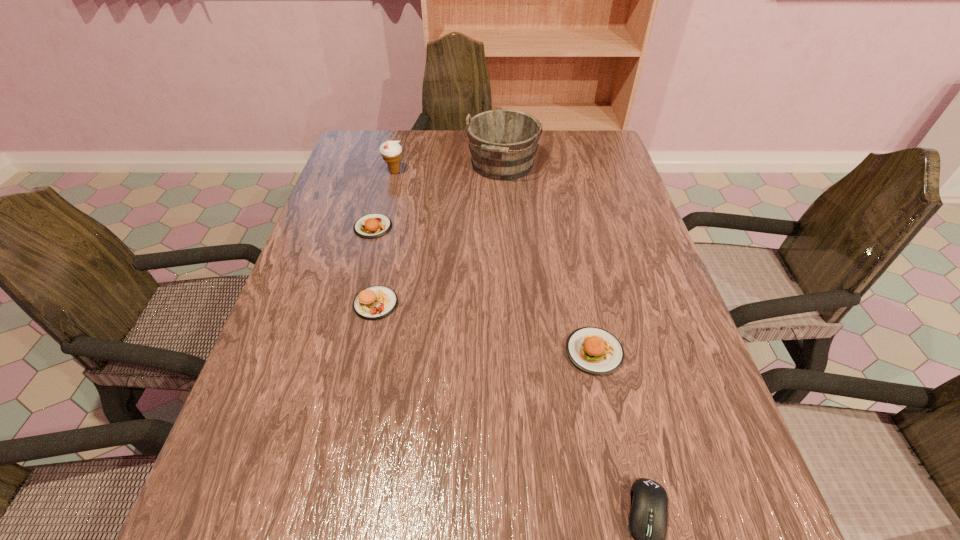
This screenshot has width=960, height=540. What are the coordinates of `vacant space at the left edge of the desktop` in the screenshot? It's located at (267, 454).

Identify the location of free space at the right edge of the desktop. The height and width of the screenshot is (540, 960). (664, 361).

In the image, there is a desktop. Identify the location of vacant space at the far left corner. (370, 136).

Locate an element on the screen. The width and height of the screenshot is (960, 540). blank space at the far right corner of the desktop is located at coordinates (577, 160).

This screenshot has height=540, width=960. Identify the location of free area in between the icecream and the wine bucket. (448, 168).

Identify the location of free space between the wine bucket and the fourth shortest object. Image resolution: width=960 pixels, height=540 pixels. (439, 234).

In order to click on free spot between the icecream and the rightmost patty (food) in this screenshot , I will do `click(494, 262)`.

The height and width of the screenshot is (540, 960). In order to click on unoccupied position between the shortest patty (food) and the fifth shortest object in this screenshot , I will do pos(384,199).

Identify the location of free space between the fourth shortest object and the wine bucket. (439, 234).

Locate an element on the screen. The height and width of the screenshot is (540, 960). empty space that is in between the third nearest object and the third farthest object is located at coordinates (374, 265).